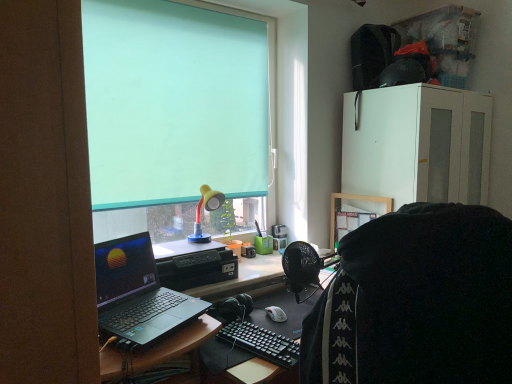
The width and height of the screenshot is (512, 384). Describe the element at coordinates (206, 210) in the screenshot. I see `yellow matte lamp at upper center` at that location.

Measure the distance between white matte cabinet at upper right and camera.

white matte cabinet at upper right and camera are 2.18 meters apart.

The image size is (512, 384). I want to click on white matte cabinet at upper right, so click(418, 144).

Measure the distance between point (x=166, y=191) and camera.

Point (x=166, y=191) and camera are 7.25 feet apart from each other.

This screenshot has height=384, width=512. I want to click on yellow matte lamp at upper center, so click(x=206, y=210).

Considering the positions of objects yellow matte lamp at upper center and black fabric at center in the image provided, who is more to the left, yellow matte lamp at upper center or black fabric at center?

yellow matte lamp at upper center is more to the left.

Is yellow matte lamp at upper center taller than black fabric at center?

No, yellow matte lamp at upper center is not taller than black fabric at center.

From a real-world perspective, relative to black fabric at center, is yellow matte lamp at upper center vertically above or below?

Clearly, from a real-world perspective, yellow matte lamp at upper center is above black fabric at center.

Is yellow matte lamp at upper center bigger than black fabric at center?

Actually, yellow matte lamp at upper center might be smaller than black fabric at center.

From a real-world perspective, is silver metallic laptop at left on black fabric at center?

No, from a real-world perspective, silver metallic laptop at left is not above black fabric at center.

Is silver metallic laptop at left next to black fabric at center and touching it?

No, silver metallic laptop at left is not beside black fabric at center.

Considering the relative positions of silver metallic laptop at left and black fabric at center in the image provided, is silver metallic laptop at left in front of black fabric at center?

No, silver metallic laptop at left is further to the viewer.

Can you tell me how much silver metallic laptop at left and black fabric at center differ in facing direction?

They differ by 91.7 degrees in their facing directions.

Considering the sizes of teal matte/soft roller blind at upper center and silver metallic laptop at left in the image, is teal matte/soft roller blind at upper center bigger or smaller than silver metallic laptop at left?

In the image, teal matte/soft roller blind at upper center appears to be larger than silver metallic laptop at left.

Is point (255, 25) less distant than point (128, 275)?

No, (255, 25) is further to viewer.

Between teal matte/soft roller blind at upper center and silver metallic laptop at left, which one is positioned in front?

Positioned in front is silver metallic laptop at left.

In terms of width, does teal matte/soft roller blind at upper center look wider or thinner when compared to silver metallic laptop at left?

In the image, teal matte/soft roller blind at upper center appears to be more narrow than silver metallic laptop at left.

Is black fabric at center inside the boundaries of yellow matte lamp at upper center, or outside?

black fabric at center is not enclosed by yellow matte lamp at upper center.

Is black fabric at center far away from yellow matte lamp at upper center?

Yes, black fabric at center and yellow matte lamp at upper center are located far from each other.

Identify the location of lamp that appears above the black fabric at center (from a real-world perspective). [206, 210].

From a real-world perspective, is black fabric at center positioned above or below yellow matte lamp at upper center?

From a real-world perspective, black fabric at center is physically below yellow matte lamp at upper center.

Is yellow matte lamp at upper center situated inside white matte cabinet at upper right or outside?

yellow matte lamp at upper center is spatially situated outside white matte cabinet at upper right.

Is yellow matte lamp at upper center smaller than white matte cabinet at upper right?

Yes.

Is point (195, 235) in front of point (456, 183)?

Yes.

Is yellow matte lamp at upper center oriented towards white matte cabinet at upper right?

No, yellow matte lamp at upper center is not facing towards white matte cabinet at upper right.

The height and width of the screenshot is (384, 512). In order to click on cabinetry that is above the silver metallic laptop at left (from a real-world perspective) in this screenshot , I will do click(x=418, y=144).

Looking at this image, in terms of height, does silver metallic laptop at left look taller or shorter compared to white matte cabinet at upper right?

Clearly, silver metallic laptop at left is shorter compared to white matte cabinet at upper right.

Does silver metallic laptop at left have a greater width compared to white matte cabinet at upper right?

No, silver metallic laptop at left is not wider than white matte cabinet at upper right.

From a real-world perspective, is silver metallic laptop at left physically below white matte cabinet at upper right?

Yes.

Does yellow matte lamp at upper center have a smaller size compared to teal matte/soft roller blind at upper center?

Yes, yellow matte lamp at upper center is smaller than teal matte/soft roller blind at upper center.

From a real-world perspective, is yellow matte lamp at upper center located higher than teal matte/soft roller blind at upper center?

Actually, yellow matte lamp at upper center is physically below teal matte/soft roller blind at upper center in the real world.

Can you confirm if yellow matte lamp at upper center is positioned to the right of teal matte/soft roller blind at upper center?

Yes.

This screenshot has width=512, height=384. I want to click on projection screen on the left side of yellow matte lamp at upper center, so click(173, 103).

Find the location of a particular element. lamp on the left of black fabric at center is located at coordinates (206, 210).

The image size is (512, 384). I want to click on laptop above the black fabric at center (from the image's perspective), so click(137, 293).

Based on their spatial positions, is teal matte/soft roller blind at upper center or black fabric at center further from silver metallic laptop at left?

Based on the image, black fabric at center appears to be further to silver metallic laptop at left.

Based on their spatial positions, is white matte cabinet at upper right or black fabric at center further from teal matte/soft roller blind at upper center?

black fabric at center is positioned further to the anchor teal matte/soft roller blind at upper center.

In the scene shown: Considering their positions, is yellow matte lamp at upper center positioned further to silver metallic laptop at left than white matte cabinet at upper right?

Among the two, white matte cabinet at upper right is located further to silver metallic laptop at left.

Which object lies nearer to the anchor point silver metallic laptop at left, yellow matte lamp at upper center or black fabric at center?

yellow matte lamp at upper center.

Considering their positions, is yellow matte lamp at upper center positioned further to white matte cabinet at upper right than silver metallic laptop at left?

silver metallic laptop at left is further to white matte cabinet at upper right.

Considering their positions, is teal matte/soft roller blind at upper center positioned closer to black fabric at center than silver metallic laptop at left?

The object closer to black fabric at center is silver metallic laptop at left.

Based on the photo, considering their positions, is yellow matte lamp at upper center positioned closer to teal matte/soft roller blind at upper center than black fabric at center?

Among the two, yellow matte lamp at upper center is located nearer to teal matte/soft roller blind at upper center.

Estimate the real-world distances between objects in this image. Which object is further from silver metallic laptop at left, black fabric at center or white matte cabinet at upper right?

white matte cabinet at upper right.

Locate an element on the screen. laptop located between black fabric at center and white matte cabinet at upper right in the depth direction is located at coordinates (137, 293).

Where is `lamp between silver metallic laptop at left and white matte cabinet at upper right`? lamp between silver metallic laptop at left and white matte cabinet at upper right is located at coordinates (206, 210).

Identify the location of lamp located between teal matte/soft roller blind at upper center and white matte cabinet at upper right in the left-right direction. This screenshot has width=512, height=384. (206, 210).

The image size is (512, 384). What are the coordinates of `projection screen between silver metallic laptop at left and white matte cabinet at upper right` in the screenshot? It's located at (173, 103).